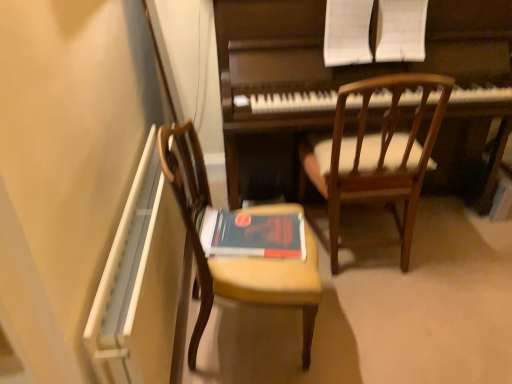
I want to click on vacant region to the right of wooden chair at left, positioned as the first chair in left-to-right order, so click(364, 330).